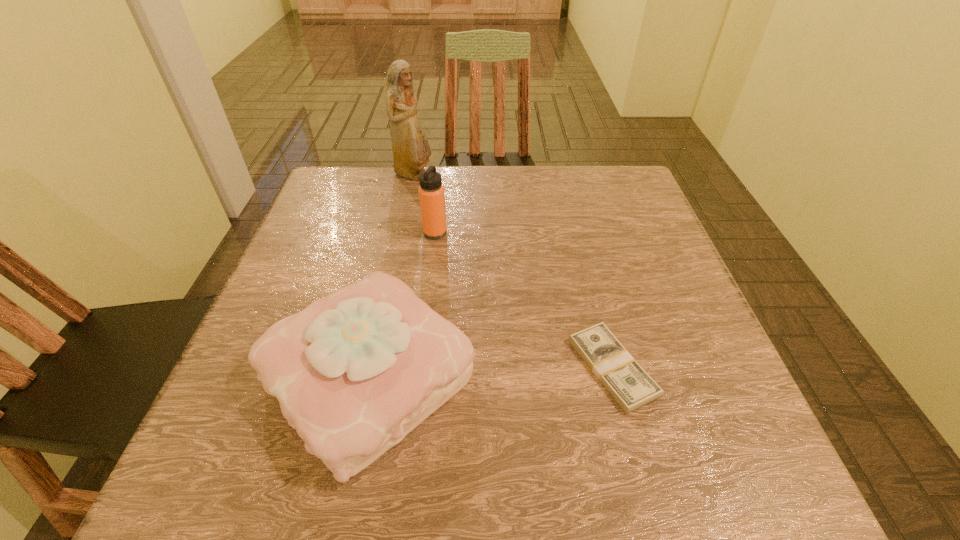
Where is `figurine`? figurine is located at coordinates (411, 151).

This screenshot has height=540, width=960. I want to click on the farthest object, so click(x=411, y=151).

At what (x,y) coordinates should I click in order to perform the action: click on the second farthest object. Please return your answer as a coordinate pair (x, y). Looking at the image, I should click on tap(431, 191).

You are a GUI agent. You are given a task and a screenshot of the screen. Output one action in this format:
    pyautogui.click(x=<x>, y=<y>)
    Task: Click on the thermos bottle
    
    Given the screenshot: What is the action you would take?
    pyautogui.click(x=431, y=191)

The width and height of the screenshot is (960, 540). Identify the location of cake. (354, 372).

Locate an element on the screen. The width and height of the screenshot is (960, 540). the rightmost object is located at coordinates (628, 383).

Where is `dollar`? dollar is located at coordinates (628, 383).

Locate an element on the screen. The height and width of the screenshot is (540, 960). free space located 0.190m on the front-facing side of the farthest object is located at coordinates (503, 175).

Locate an element on the screen. The height and width of the screenshot is (540, 960). vacant area located on the back of the thermos bottle is located at coordinates (441, 186).

The image size is (960, 540). Identify the location of free location located on the right of the cake. (511, 376).